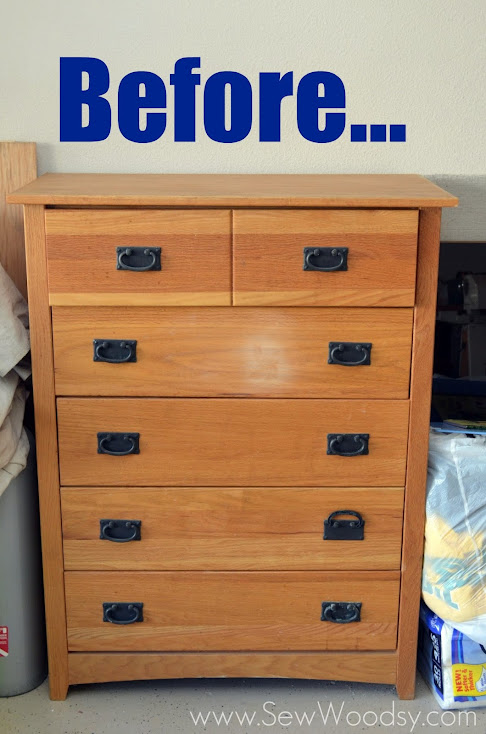
Where is `bed frame`? bed frame is located at coordinates (26, 164).